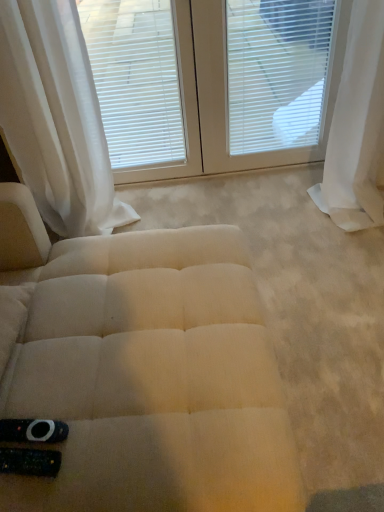
Locate an element on the screen. free point below white plastic blinds at upper center (from a real-world perspective) is located at coordinates (269, 173).